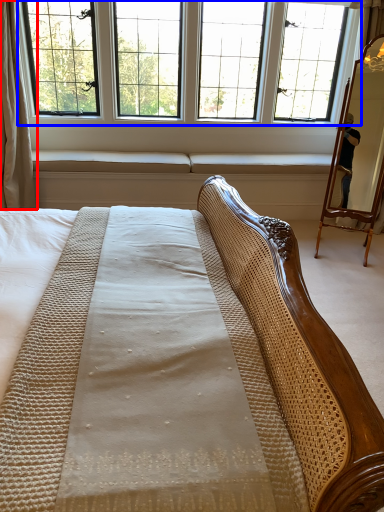
Question: Which point is further to the camera, curtain (highlighted by a red box) or window (highlighted by a blue box)?

Choices:
 (A) curtain
 (B) window

Answer: (B)